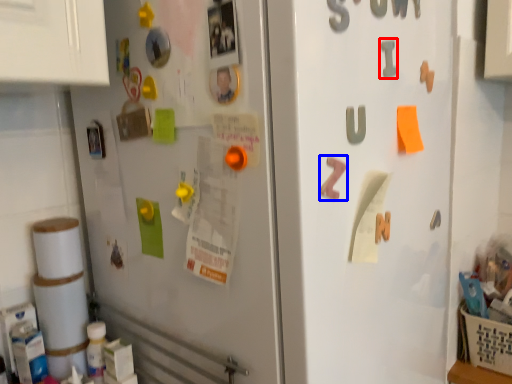
Question: Which object appears farthest to the camera in this image, alphabet (highlighted by a red box) or alphabet (highlighted by a blue box)?

Choices:
 (A) alphabet
 (B) alphabet

Answer: (A)